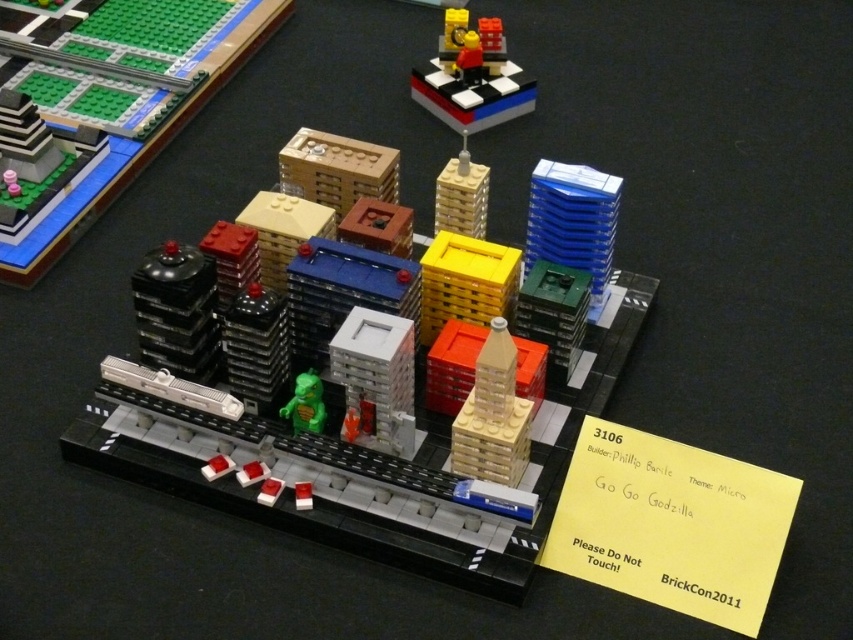
Between point (170, 416) and point (316, 417), which one is positioned in front?

Point (316, 417) is in front.

I want to click on smooth plastic cityscape at center, so click(364, 468).

Is brick-like figure at upper center thinner than light brown plastic building at center?

Incorrect, brick-like figure at upper center's width is not less than light brown plastic building at center's.

Does point (469, 88) come in front of point (320, 172)?

That is False.

Find the location of `brick-like figure at upper center`. brick-like figure at upper center is located at coordinates (473, 76).

Does shiny black dome at left come in front of light brown plastic tower at center?

No, it is behind light brown plastic tower at center.

Is shiny black dome at left to the left of light brown plastic tower at center from the viewer's perspective?

Indeed, shiny black dome at left is positioned on the left side of light brown plastic tower at center.

Image resolution: width=853 pixels, height=640 pixels. Describe the element at coordinates (135, 152) in the screenshot. I see `shiny black dome at left` at that location.

The height and width of the screenshot is (640, 853). What are the coordinates of `shiny black dome at left` in the screenshot? It's located at (135, 152).